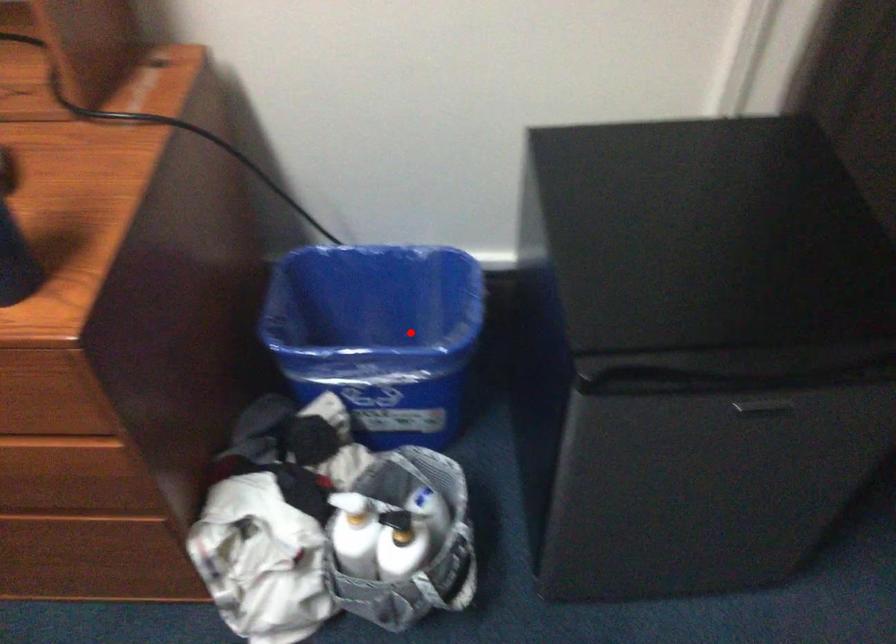
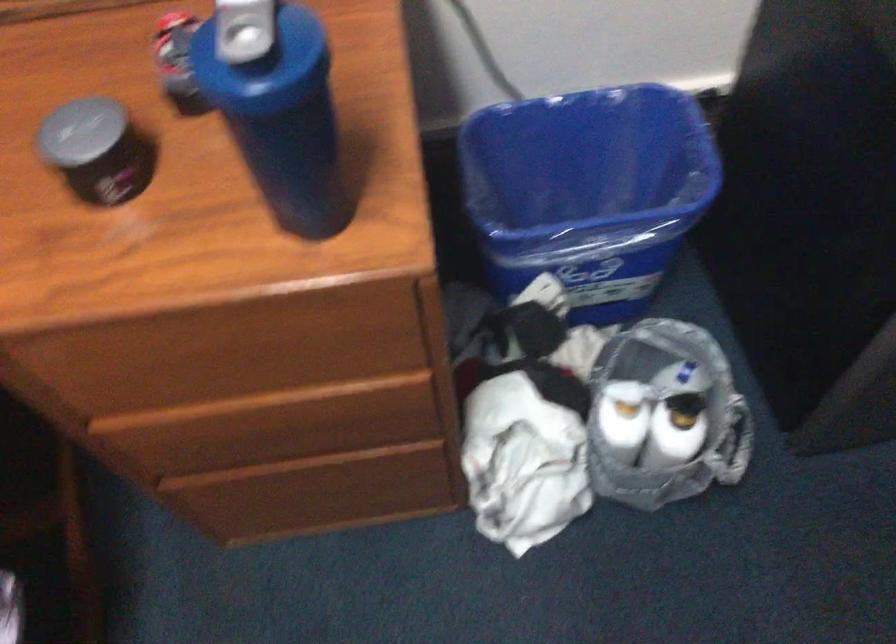
Question: I am providing you with two images of the same scene from different viewpoints. A red point is shown in image1. For the corresponding object point in image2, is it positioned nearer or farther from the camera?

Choices:
 (A) Nearer
 (B) Farther

Answer: (A)